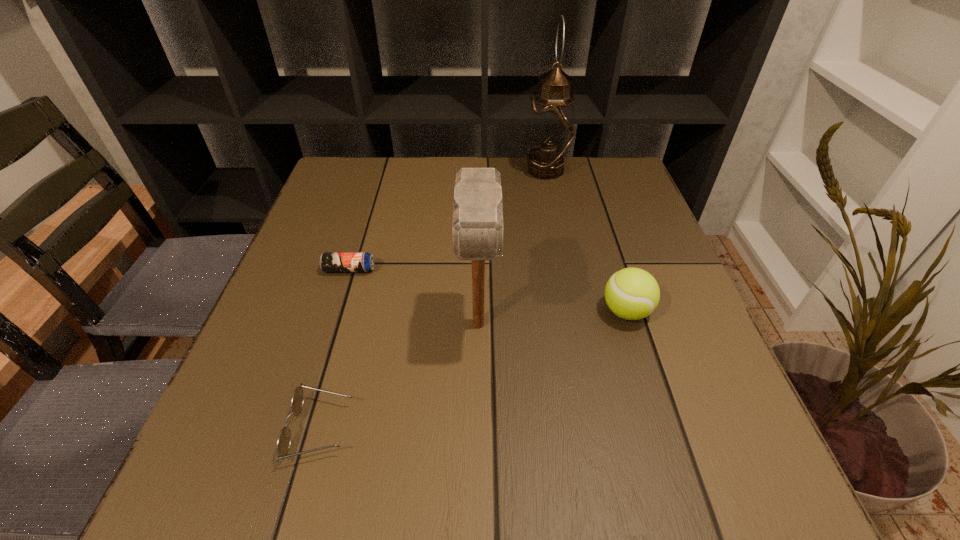
This screenshot has width=960, height=540. What are the coordinates of `vacant position located on the front-facing side of the nearest object` in the screenshot? It's located at (598, 429).

This screenshot has height=540, width=960. Find the location of `free location located on the back of the beer can`. free location located on the back of the beer can is located at coordinates (364, 224).

You are a GUI agent. You are given a task and a screenshot of the screen. Output one action in this format:
    pyautogui.click(x=<x>, y=<y>)
    Task: Click on the object that is at the far edge
    The height and width of the screenshot is (540, 960).
    Given the screenshot: What is the action you would take?
    pyautogui.click(x=550, y=131)

Find the location of a particular element. object present at the near edge is located at coordinates (283, 443).

The image size is (960, 540). In order to click on spectacles that is at the left edge in this screenshot , I will do [x=283, y=443].

The height and width of the screenshot is (540, 960). What are the coordinates of `beer can present at the left edge` in the screenshot? It's located at (329, 261).

Identify the location of object that is at the right edge. (632, 293).

Locate an element on the screen. object located in the near left corner section of the desktop is located at coordinates (283, 443).

In the image, there is a desktop. Where is `vacant space at the far edge`? vacant space at the far edge is located at coordinates (564, 204).

The height and width of the screenshot is (540, 960). In the image, there is a desktop. In order to click on blank space at the near edge in this screenshot , I will do `click(543, 456)`.